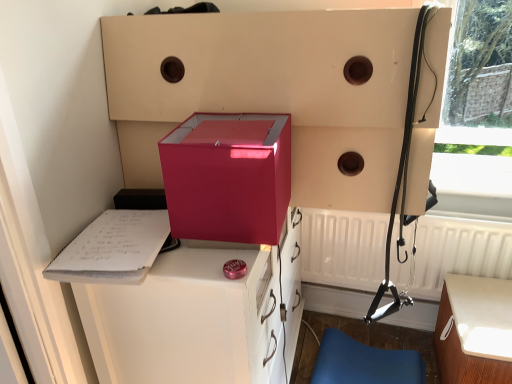
Question: Is white wood table at lower right facing away from glossy plastic vanity at center?

Choices:
 (A) yes
 (B) no

Answer: (B)

Question: Does white wood table at lower right have a greater width compared to glossy plastic vanity at center?

Choices:
 (A) yes
 (B) no

Answer: (B)

Question: Is white wood table at lower right beside glossy plastic vanity at center?

Choices:
 (A) no
 (B) yes

Answer: (A)

Question: Is white wood table at lower right to the right of glossy plastic vanity at center from the viewer's perspective?

Choices:
 (A) no
 (B) yes

Answer: (B)

Question: Can you confirm if white wood table at lower right is bigger than glossy plastic vanity at center?

Choices:
 (A) no
 (B) yes

Answer: (A)

Question: Is glossy plastic vanity at center located within white wood table at lower right?

Choices:
 (A) yes
 (B) no

Answer: (B)

Question: Are glossy plastic vanity at center and matte black harness at right far apart?

Choices:
 (A) yes
 (B) no

Answer: (B)

Question: From the image's perspective, does glossy plastic vanity at center appear lower than matte black harness at right?

Choices:
 (A) yes
 (B) no

Answer: (A)

Question: Is glossy plastic vanity at center facing towards matte black harness at right?

Choices:
 (A) yes
 (B) no

Answer: (A)

Question: Does glossy plastic vanity at center have a lesser width compared to matte black harness at right?

Choices:
 (A) yes
 (B) no

Answer: (B)

Question: Is glossy plastic vanity at center facing away from matte black harness at right?

Choices:
 (A) no
 (B) yes

Answer: (A)

Question: Is glossy plastic vanity at center surrounding matte black harness at right?

Choices:
 (A) no
 (B) yes

Answer: (A)

Question: Does white matte radiator at lower right have a smaller size compared to matte black harness at right?

Choices:
 (A) no
 (B) yes

Answer: (A)